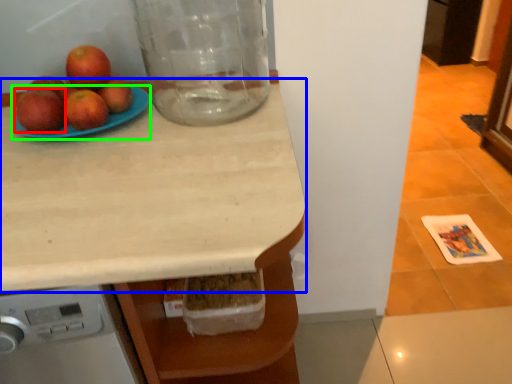
Question: Based on their relative distances, which object is nearer to apple (highlighted by a red box)? Choose from countertop (highlighted by a blue box) and glass plate (highlighted by a green box).

Choices:
 (A) countertop
 (B) glass plate

Answer: (B)